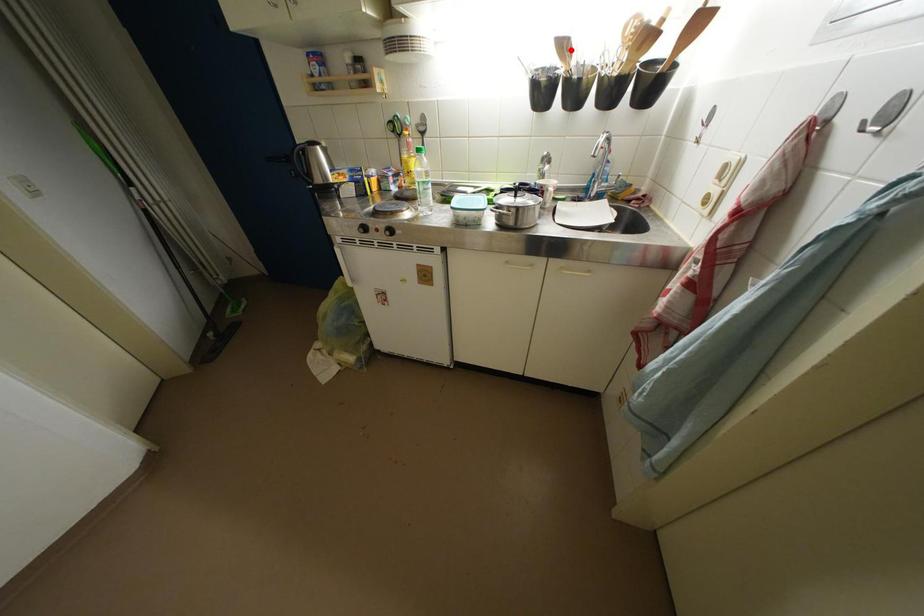
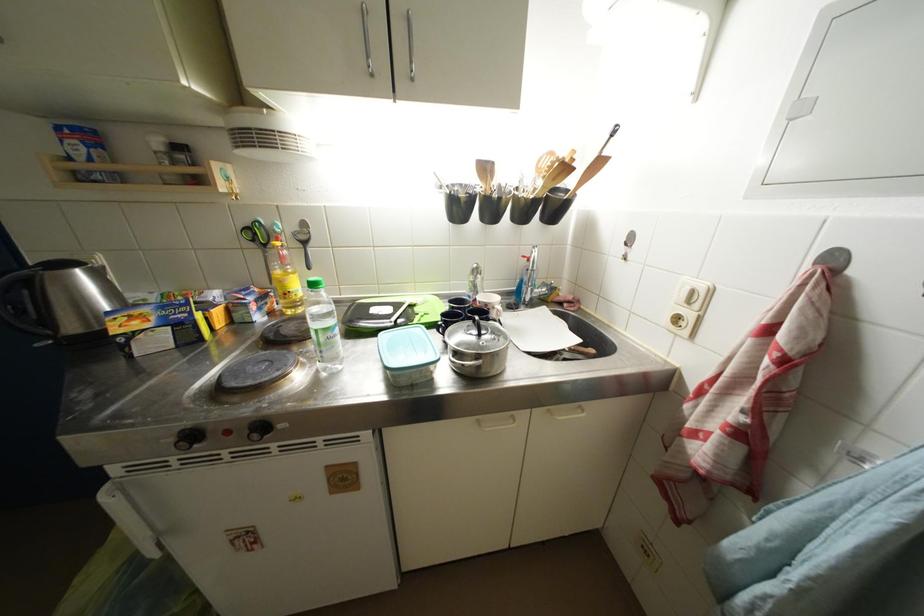
Where in the second image is the point corresponding to the highlighted location from the first image?

(492, 172)